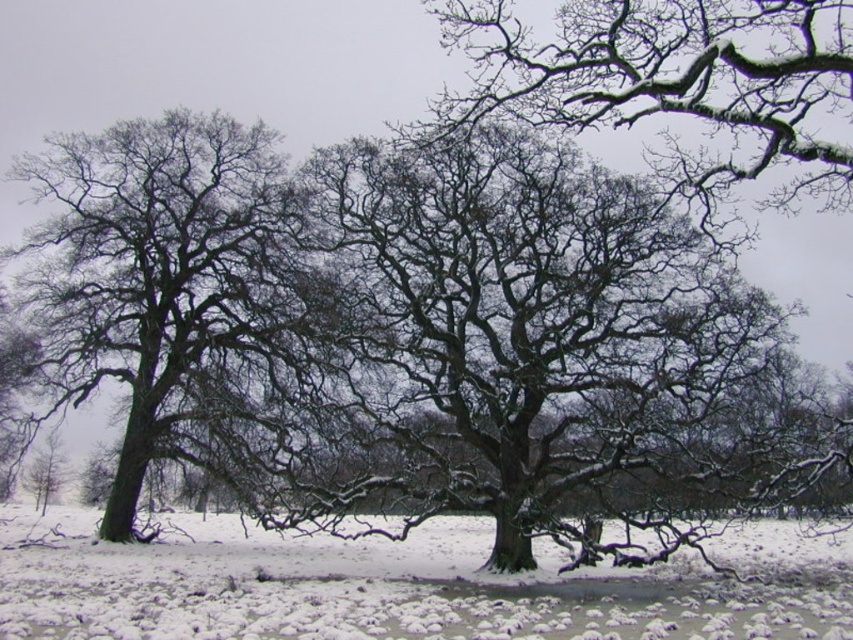
Based on the photo, can you confirm if white powdery snow at center is smaller than snow-covered branches at left?

Actually, white powdery snow at center might be larger than snow-covered branches at left.

Between white powdery snow at center and snow-covered branches at left, which one is positioned lower?

white powdery snow at center is below.

Which is behind, point (836, 561) or point (142, 256)?

Point (142, 256)

Where is `white powdery snow at center`? The height and width of the screenshot is (640, 853). white powdery snow at center is located at coordinates (404, 586).

Between snow-covered branches at left and snow-covered branches at upper center, which one has less height?

With less height is snow-covered branches at upper center.

Which is behind, point (288, 288) or point (766, 13)?

The point (288, 288) is behind.

Between point (260, 312) and point (822, 51), which one is positioned behind?

Positioned behind is point (260, 312).

Where is `snow-covered branches at left`? Image resolution: width=853 pixels, height=640 pixels. snow-covered branches at left is located at coordinates (158, 266).

Can you confirm if white powdery snow at center is smaller than snow-covered branches at upper center?

Incorrect, white powdery snow at center is not smaller in size than snow-covered branches at upper center.

Between point (490, 541) and point (724, 97), which one is positioned behind?

Point (490, 541)

Find the location of a particular element. This screenshot has height=640, width=853. white powdery snow at center is located at coordinates point(404,586).